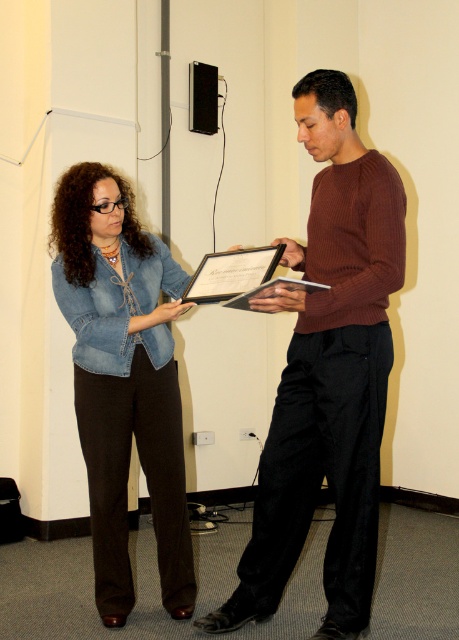
You are organizing a photoshoot and need to ensure that the two central outfits in the image are appropriately sized for the models. Given that the brown ribbed sweater at center and the denim jacket at center are both part of the wardrobe, which outfit requires a larger size to accommodate the model?

The brown ribbed sweater at center requires a larger size because it is larger in size than the denim jacket at center according to the description.

You are standing in the conference room and need to place a new plant pot that is 0.3 meters in diameter. Where should you place it so that it doesn not block the brown ribbed sweater at center located at point (328, 372)?

Place the plant pot at least 0.15 meters away from point (328, 372) to ensure it does not block the brown ribbed sweater at center.

You are an observer in the scene. You notice two people at center. The person wearing the brown ribbed sweater at center and the person wearing the denim jacket at center. Which one is positioned to the right?

The brown ribbed sweater at center is to the right of the denim jacket at center.